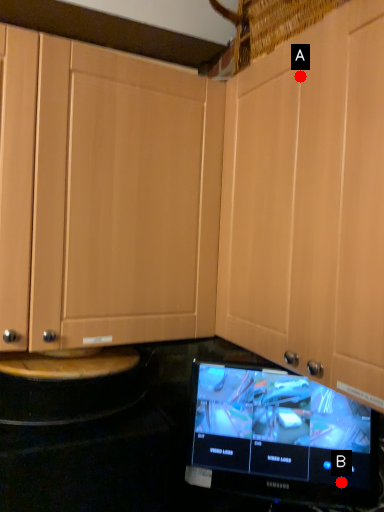
Question: Two points are circled on the image, labeled by A and B beside each circle. Among these points, which one is farthest from the camera?

Choices:
 (A) A is further
 (B) B is further

Answer: (B)